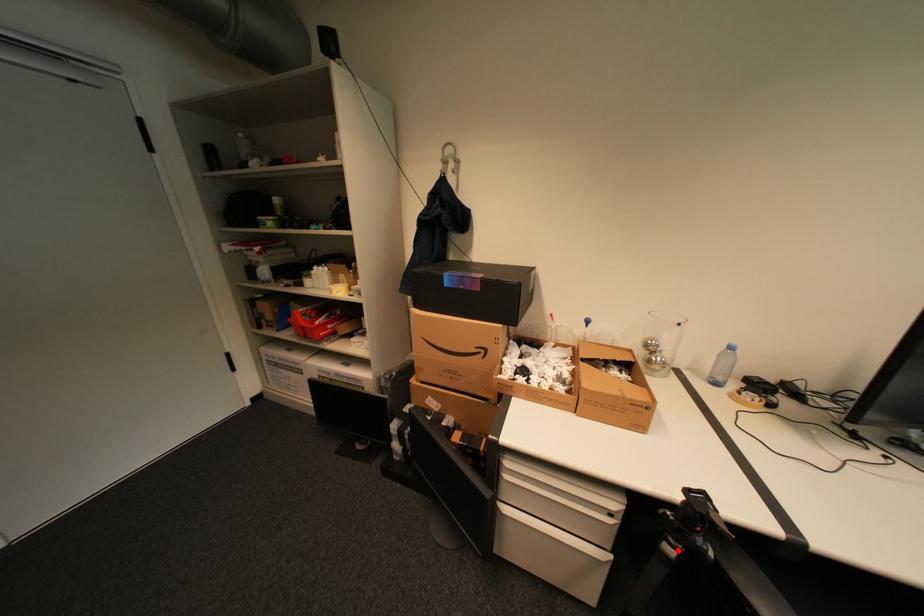
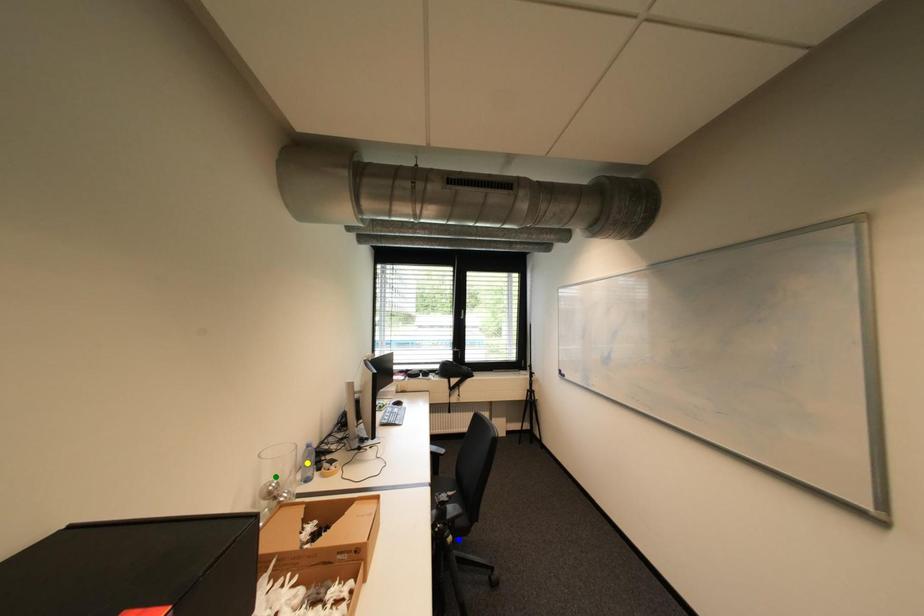
Question: I am providing you with two images of the same scene from different viewpoints. A red point is marked on the first image. You are given multiple points on the second image. Which spot in image 2 lines up with the point in image 1?

Choices:
 (A) yellow point
 (B) blue point
 (C) green point

Answer: (B)